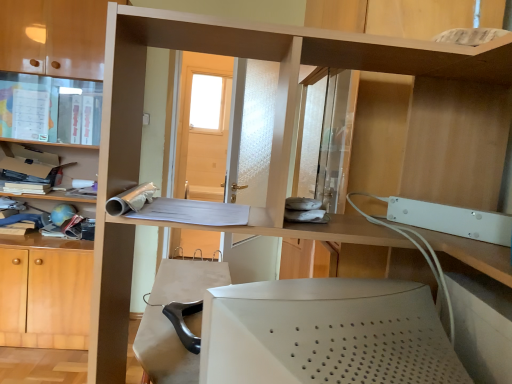
Image resolution: width=512 pixels, height=384 pixels. What are the coordinates of `matte plastic shelf at left, which is the first shelf in left-to-right order` in the screenshot? It's located at pyautogui.click(x=38, y=144).

Locate an element on the screen. The width and height of the screenshot is (512, 384). white matte desktop computer at lower center is located at coordinates (326, 334).

Find the location of a particular element. Image resolution: width=512 pixels, height=384 pixels. matte brown bookcase at left is located at coordinates (55, 36).

Find the location of a particular element. wooden shelf at upper right, which appears as the first shelf when viewed from the right is located at coordinates (482, 64).

You are a GUI agent. You are given a task and a screenshot of the screen. Output one action in this format:
    pyautogui.click(x=<x>, y=<y>)
    Task: Click on the matte plastic shelf at left, which is counted as the 2th shelf, starting from the right
    This screenshot has height=384, width=512.
    Given the screenshot: What is the action you would take?
    pyautogui.click(x=38, y=144)

Is there a large distance between matte plastic shelf at left, the 1th shelf positioned from the back, and wooden shelf at upper right, placed as the second shelf when sorted from back to front?

Indeed, matte plastic shelf at left, the 1th shelf positioned from the back, is not near wooden shelf at upper right, placed as the second shelf when sorted from back to front.

Is wooden shelf at upper right, which appears as the first shelf when viewed from the right, a part of matte plastic shelf at left, the 1th shelf positioned from the back?

That's incorrect, wooden shelf at upper right, which appears as the first shelf when viewed from the right, is not inside matte plastic shelf at left, the 1th shelf positioned from the back.

How distant is matte plastic shelf at left, which is counted as the 2th shelf, starting from the right, from wooden shelf at upper right, which ranks as the first shelf in front-to-back order?

They are 7.16 feet apart.

From a real-world perspective, is matte brown bookcase at left positioned under matte plastic shelf at left, the 1th shelf positioned from the back, based on gravity?

No, from a real-world perspective, matte brown bookcase at left is not under matte plastic shelf at left, the 1th shelf positioned from the back.

Is matte brown bookcase at left turned away from matte plastic shelf at left, which is the first shelf in left-to-right order?

Absolutely, matte brown bookcase at left is directed away from matte plastic shelf at left, which is the first shelf in left-to-right order.

From the image's perspective, is matte brown bookcase at left located above or below matte plastic shelf at left, marked as the second shelf in a front-to-back arrangement?

Based on their image positions, matte brown bookcase at left is located beneath matte plastic shelf at left, marked as the second shelf in a front-to-back arrangement.

Which of these two, matte brown bookcase at left or matte plastic shelf at left, which is counted as the 2th shelf, starting from the right, is wider?

matte brown bookcase at left.

From a real-world perspective, which is physically below, wooden shelf at upper right, which appears as the first shelf when viewed from the right, or matte plastic shelf at left, which is the first shelf in left-to-right order?

matte plastic shelf at left, which is the first shelf in left-to-right order.

Considering the relative positions of wooden shelf at upper right, which ranks as the first shelf in front-to-back order, and matte plastic shelf at left, marked as the second shelf in a front-to-back arrangement, in the image provided, is wooden shelf at upper right, which ranks as the first shelf in front-to-back order, to the left of matte plastic shelf at left, marked as the second shelf in a front-to-back arrangement, from the viewer's perspective?

Incorrect, wooden shelf at upper right, which ranks as the first shelf in front-to-back order, is not on the left side of matte plastic shelf at left, marked as the second shelf in a front-to-back arrangement.

Considering the sizes of wooden shelf at upper right, which appears as the first shelf when viewed from the right, and matte plastic shelf at left, which is counted as the 2th shelf, starting from the right, in the image, is wooden shelf at upper right, which appears as the first shelf when viewed from the right, wider or thinner than matte plastic shelf at left, which is counted as the 2th shelf, starting from the right,?

In the image, wooden shelf at upper right, which appears as the first shelf when viewed from the right, appears to be more narrow than matte plastic shelf at left, which is counted as the 2th shelf, starting from the right.

From the picture: Considering their positions, is wooden shelf at upper right, the second shelf positioned from the left, located in front of or behind matte plastic shelf at left, which is counted as the 2th shelf, starting from the right?

Visually, wooden shelf at upper right, the second shelf positioned from the left, is located in front of matte plastic shelf at left, which is counted as the 2th shelf, starting from the right.

Between matte plastic shelf at left, marked as the second shelf in a front-to-back arrangement, and matte brown bookcase at left, which one appears on the right side from the viewer's perspective?

matte brown bookcase at left is more to the right.

I want to click on bookcase below the matte plastic shelf at left, marked as the second shelf in a front-to-back arrangement (from the image's perspective), so click(55, 36).

Considering the relative sizes of matte plastic shelf at left, which is counted as the 2th shelf, starting from the right, and matte brown bookcase at left in the image provided, is matte plastic shelf at left, which is counted as the 2th shelf, starting from the right, taller than matte brown bookcase at left?

No.

From the image's perspective, relative to matte brown bookcase at left, is matte plastic shelf at left, marked as the second shelf in a front-to-back arrangement, above or below?

From the image's perspective, matte plastic shelf at left, marked as the second shelf in a front-to-back arrangement, appears above matte brown bookcase at left.

Identify the location of desktop computer below the matte brown bookcase at left (from the image's perspective). The image size is (512, 384). (326, 334).

Is point (440, 352) positioned after point (14, 62)?

That is False.

From a real-world perspective, is white matte desktop computer at lower center positioned under matte brown bookcase at left based on gravity?

Yes.

Is the depth of white matte desktop computer at lower center less than that of matte plastic shelf at left, marked as the second shelf in a front-to-back arrangement?

Yes, it is.

From the picture: From the image's perspective, is white matte desktop computer at lower center under matte plastic shelf at left, which is the first shelf in left-to-right order?

Correct, white matte desktop computer at lower center appears lower than matte plastic shelf at left, which is the first shelf in left-to-right order, in the image.

Which point is more distant from viewer, (311, 310) or (10, 144)?

The point (10, 144) is more distant.

From a real-world perspective, count 1st shelfs upward from the white matte desktop computer at lower center and point to it. Please provide its 2D coordinates.

[(38, 144)]

I want to click on desktop computer that appears on the right of matte brown bookcase at left, so click(x=326, y=334).

Which is more to the left, matte brown bookcase at left or white matte desktop computer at lower center?

From the viewer's perspective, matte brown bookcase at left appears more on the left side.

Which of these two, matte brown bookcase at left or white matte desktop computer at lower center, is smaller?

white matte desktop computer at lower center.

From the image's perspective, does matte brown bookcase at left appear lower than white matte desktop computer at lower center?

No.

This screenshot has width=512, height=384. I want to click on shelf below the wooden shelf at upper right, which appears as the first shelf when viewed from the right (from the image's perspective), so click(x=38, y=144).

Image resolution: width=512 pixels, height=384 pixels. In order to click on shelf behind the matte brown bookcase at left in this screenshot , I will do `click(38, 144)`.

Considering their positions, is matte brown bookcase at left positioned closer to white matte desktop computer at lower center than matte plastic shelf at left, which is the first shelf in left-to-right order?

The object closer to white matte desktop computer at lower center is matte brown bookcase at left.

Looking at the image, which one is located further to white matte desktop computer at lower center, wooden shelf at upper right, placed as the second shelf when sorted from back to front, or matte plastic cabinet at upper left?

matte plastic cabinet at upper left is further to white matte desktop computer at lower center.

Estimate the real-world distances between objects in this image. Which object is further from matte plastic cabinet at upper left, wooden shelf at upper right, placed as the second shelf when sorted from back to front, or matte plastic shelf at left, which is the first shelf in left-to-right order?

wooden shelf at upper right, placed as the second shelf when sorted from back to front, lies further to matte plastic cabinet at upper left than the other object.

Considering their positions, is wooden shelf at upper right, which ranks as the first shelf in front-to-back order, positioned further to matte plastic cabinet at upper left than matte brown bookcase at left?

wooden shelf at upper right, which ranks as the first shelf in front-to-back order, is further to matte plastic cabinet at upper left.

Which object lies nearer to the anchor point matte plastic cabinet at upper left, matte plastic shelf at left, which is counted as the 2th shelf, starting from the right, or white matte desktop computer at lower center?

matte plastic shelf at left, which is counted as the 2th shelf, starting from the right, is closer to matte plastic cabinet at upper left.

Estimate the real-world distances between objects in this image. Which object is further from matte plastic shelf at left, which is the first shelf in left-to-right order, matte plastic cabinet at upper left or white matte desktop computer at lower center?

white matte desktop computer at lower center lies further to matte plastic shelf at left, which is the first shelf in left-to-right order, than the other object.

Based on their spatial positions, is matte plastic shelf at left, marked as the second shelf in a front-to-back arrangement, or matte brown bookcase at left further from wooden shelf at upper right, which ranks as the first shelf in front-to-back order?

matte plastic shelf at left, marked as the second shelf in a front-to-back arrangement, is further to wooden shelf at upper right, which ranks as the first shelf in front-to-back order.

When comparing their distances from matte plastic shelf at left, the 1th shelf positioned from the back, does wooden shelf at upper right, which appears as the first shelf when viewed from the right, or matte brown bookcase at left seem further?

Based on the image, wooden shelf at upper right, which appears as the first shelf when viewed from the right, appears to be further to matte plastic shelf at left, the 1th shelf positioned from the back.

This screenshot has width=512, height=384. I want to click on shelf between white matte desktop computer at lower center and matte plastic shelf at left, marked as the second shelf in a front-to-back arrangement, along the z-axis, so click(482, 64).

At what (x,y) coordinates should I click in order to perform the action: click on shelf between white matte desktop computer at lower center and matte brown bookcase at left in the front-back direction. Please return your answer as a coordinate pair (x, y). The image size is (512, 384). Looking at the image, I should click on (482, 64).

Find the location of a particular element. This screenshot has width=512, height=384. bookcase positioned between white matte desktop computer at lower center and matte plastic cabinet at upper left from near to far is located at coordinates (55, 36).

You are a GUI agent. You are given a task and a screenshot of the screen. Output one action in this format:
    pyautogui.click(x=<x>, y=<y>)
    Task: Click on the cabinet located between wooden shelf at upper right, which ranks as the first shelf in front-to-back order, and matte plastic shelf at left, which is counted as the 2th shelf, starting from the right, in the depth direction
    
    Given the screenshot: What is the action you would take?
    pyautogui.click(x=50, y=109)